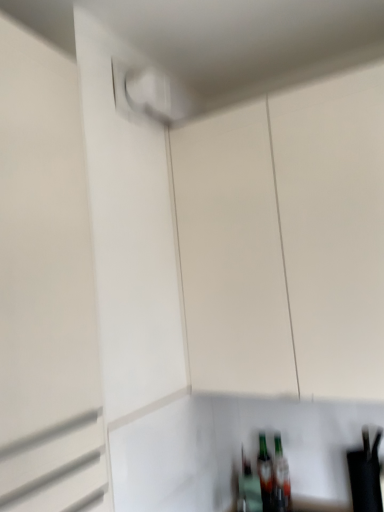
Question: Does point (284, 289) appear closer or farther from the camera than point (18, 349)?

Choices:
 (A) farther
 (B) closer

Answer: (A)

Question: From a real-world perspective, is white matte cabinet at center positioned above or below white matte garage door at upper left?

Choices:
 (A) above
 (B) below

Answer: (A)

Question: Which is correct: white matte cabinet at center is inside white matte garage door at upper left, or outside of it?

Choices:
 (A) inside
 (B) outside

Answer: (B)

Question: Is white matte garage door at upper left to the left or to the right of white matte cabinet at center in the image?

Choices:
 (A) right
 (B) left

Answer: (B)

Question: Is point (59, 497) closer or farther from the camera than point (253, 119)?

Choices:
 (A) farther
 (B) closer

Answer: (B)

Question: Considering their positions, is white matte garage door at upper left located in front of or behind white matte cabinet at center?

Choices:
 (A) behind
 (B) front

Answer: (B)

Question: Considering the positions of white matte garage door at upper left and white matte cabinet at center in the image, is white matte garage door at upper left wider or thinner than white matte cabinet at center?

Choices:
 (A) wide
 (B) thin

Answer: (B)